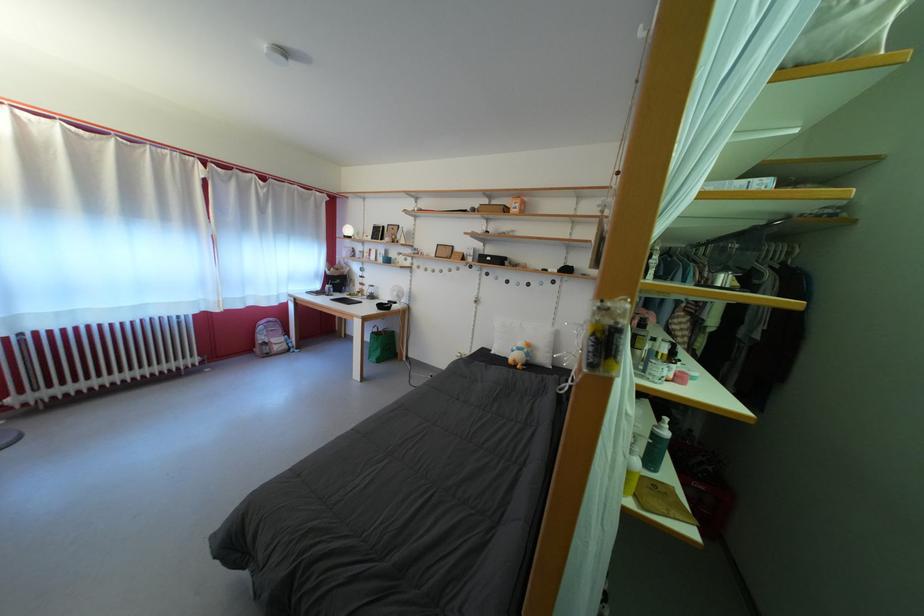
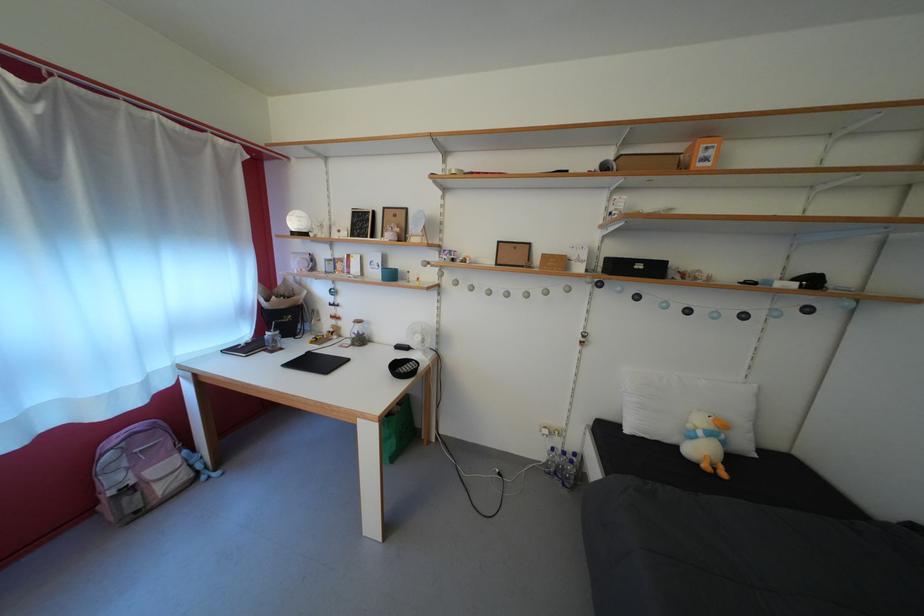
The point at (x=536, y=361) is marked in the first image. Where is the corresponding point in the second image?

(732, 448)